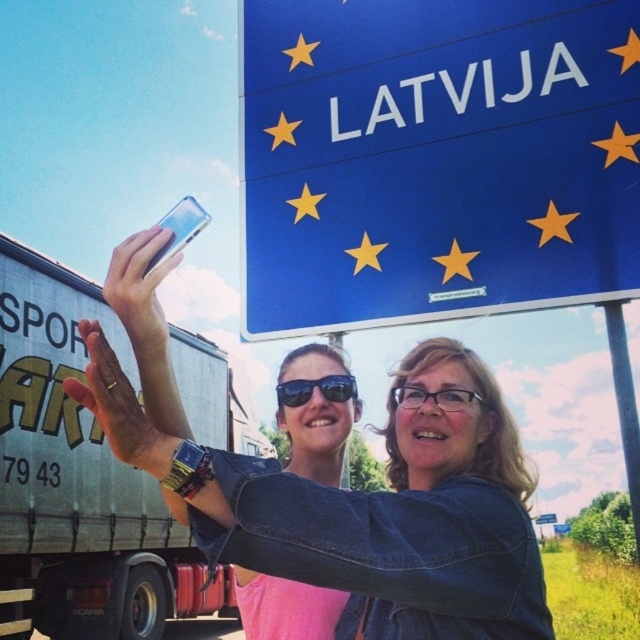
Question: Is clear glass phone at upper left in front of blue plastic street sign at upper center?

Choices:
 (A) no
 (B) yes

Answer: (B)

Question: Does sunglasses at center come in front of blue plastic street sign at upper center?

Choices:
 (A) no
 (B) yes

Answer: (B)

Question: Can you confirm if denim jacket at center is wider than sunglasses at center?

Choices:
 (A) yes
 (B) no

Answer: (A)

Question: Which point appears farthest from the camera in this image?

Choices:
 (A) (563, 529)
 (B) (417, 45)
 (C) (339, 392)

Answer: (A)

Question: Considering the real-world distances, which object is farthest from the blue plastic road sign at upper center?

Choices:
 (A) blue plastic street sign at upper center
 (B) blue glossy sign at upper center
 (C) sunglasses at center
 (D) denim jacket at center

Answer: (D)

Question: Considering the real-world distances, which object is closest to the clear glass phone at upper left?

Choices:
 (A) blue plastic street sign at upper center
 (B) sunglasses at center
 (C) metallic silver truck at left
 (D) blue plastic road sign at upper center

Answer: (B)